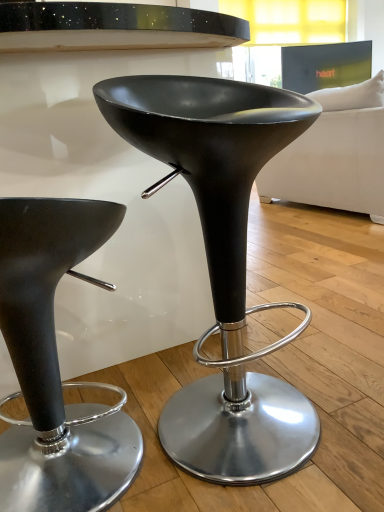
Question: Is matte black stool at center, the 1th stool in the left-to-right sequence, to the right of matte black stool at center, positioned as the 2th stool in left-to-right order, from the viewer's perspective?

Choices:
 (A) no
 (B) yes

Answer: (A)

Question: Is matte black stool at center, the 1th stool in the left-to-right sequence, aimed at matte black stool at center, positioned as the 2th stool in left-to-right order?

Choices:
 (A) no
 (B) yes

Answer: (A)

Question: Is matte black stool at center, the second stool in the right-to-left sequence, turned away from matte black stool at center, which is the first stool from right to left?

Choices:
 (A) no
 (B) yes

Answer: (A)

Question: Is matte black stool at center, the second stool in the right-to-left sequence, surrounding matte black stool at center, positioned as the 2th stool in left-to-right order?

Choices:
 (A) yes
 (B) no

Answer: (B)

Question: Is matte black stool at center, the second stool in the right-to-left sequence, outside of matte black stool at center, positioned as the 2th stool in left-to-right order?

Choices:
 (A) no
 (B) yes

Answer: (B)

Question: Is matte black stool at center, positioned as the 2th stool in left-to-right order, to the left or to the right of white fabric couch at upper right in the image?

Choices:
 (A) left
 (B) right

Answer: (A)

Question: Is point (273, 387) positioned closer to the camera than point (360, 181)?

Choices:
 (A) farther
 (B) closer

Answer: (B)

Question: Considering their positions, is matte black stool at center, positioned as the 2th stool in left-to-right order, located in front of or behind white fabric couch at upper right?

Choices:
 (A) behind
 (B) front

Answer: (B)

Question: Is matte black stool at center, which is the first stool from right to left, wider or thinner than white fabric couch at upper right?

Choices:
 (A) thin
 (B) wide

Answer: (A)

Question: In terms of height, does matte black stool at center, the 1th stool in the left-to-right sequence, look taller or shorter compared to white fabric couch at upper right?

Choices:
 (A) tall
 (B) short

Answer: (B)

Question: Based on their positions, is matte black stool at center, the second stool in the right-to-left sequence, located to the left or right of white fabric couch at upper right?

Choices:
 (A) left
 (B) right

Answer: (A)

Question: Considering their positions, is matte black stool at center, the 1th stool in the left-to-right sequence, located in front of or behind white fabric couch at upper right?

Choices:
 (A) front
 (B) behind

Answer: (A)

Question: Is matte black stool at center, the 1th stool in the left-to-right sequence, situated inside white fabric couch at upper right or outside?

Choices:
 (A) inside
 (B) outside

Answer: (B)

Question: Do you think matte black stool at center, which is the first stool from right to left, is within matte black stool at center, the second stool in the right-to-left sequence, or outside of it?

Choices:
 (A) outside
 (B) inside

Answer: (A)

Question: Does point (233, 174) appear closer or farther from the camera than point (132, 478)?

Choices:
 (A) farther
 (B) closer

Answer: (B)